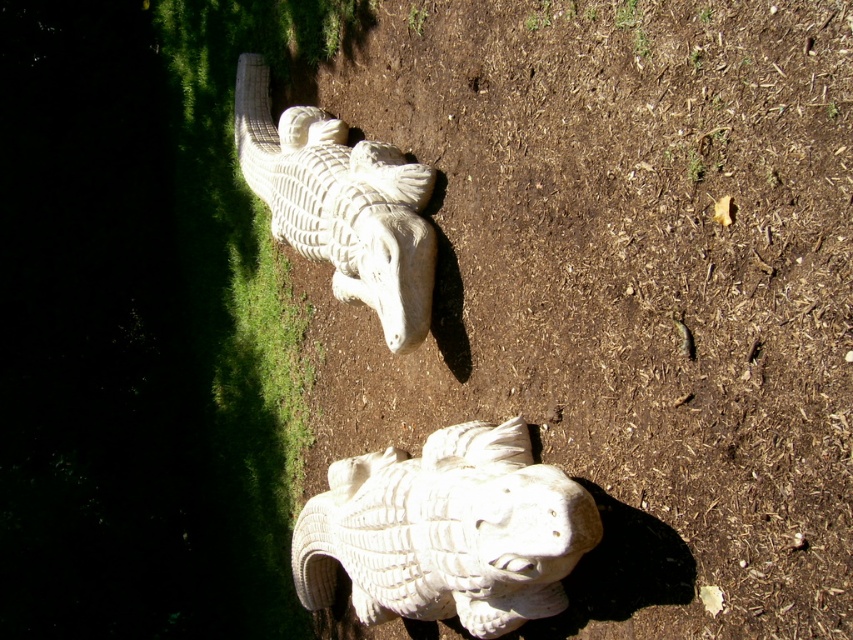
You are a gardener who needs to water the plants behind the white stone fish at lower center and the white stone crocodile at upper center. Which object should you move first to access the plants?

You should move the white stone fish at lower center first because it is in front of the white stone crocodile at upper center, so moving it first will allow access to the plants behind both objects.

You are a gardener who wants to place a new plant between the white stone fish at lower center and the white stone crocodile at upper center. Based on their positions, where should you place the plant so it is exactly halfway between them?

The white stone fish at lower center is below the white stone crocodile at upper center, so placing the plant halfway between them would mean positioning it vertically between the two, closer to the middle of the image.

You are a gardener who needs to place a new decorative item between the white stone fish at lower center and the white stone crocodile at upper center. Based on their positions, where should you place the new item to ensure it is centered between them?

The white stone fish at lower center is to the right of the white stone crocodile at upper center, so placing the new item halfway between their positions would require positioning it to the right of the crocodile and to the left of the fish to center it between them.